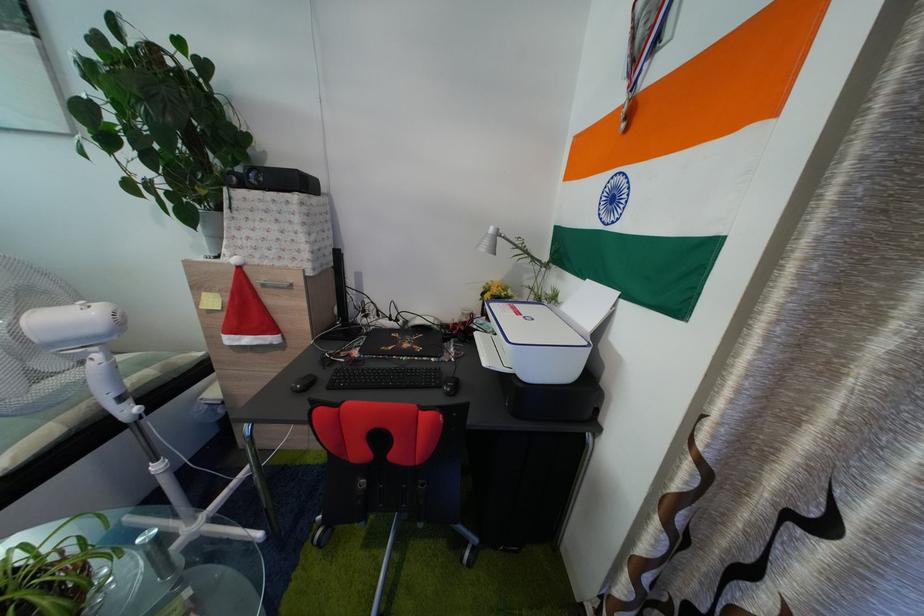
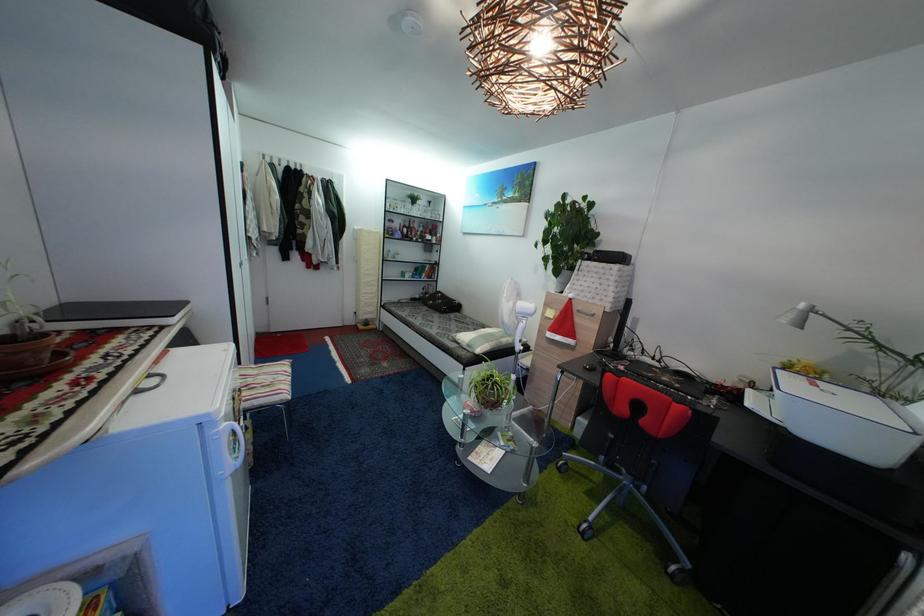
Question: Based on the continuous images, in which direction is the camera rotating? Reply with the corresponding letter.

Choices:
 (A) Left
 (B) Right
 (C) Up
 (D) Down

Answer: (A)